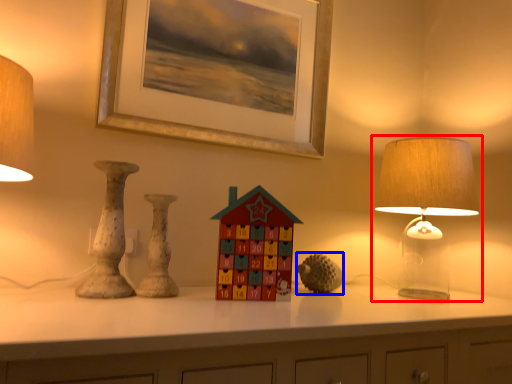
Question: Among these objects, which one is nearest to the camera, lamp (highlighted by a red box) or toy (highlighted by a blue box)?

Choices:
 (A) lamp
 (B) toy

Answer: (A)